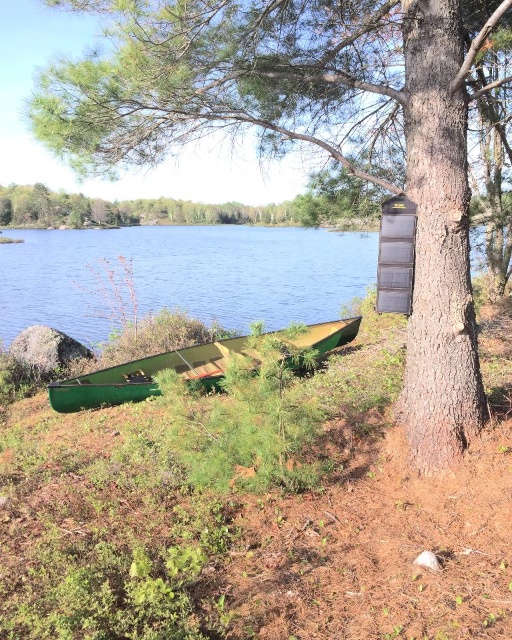
You are a hiker who wants to cross the lake using the green matte canoe at lower left. The smooth bark tree at center has a rope tied around it. Can you reach the tree from the canoe without getting out of the water?

The smooth bark tree at center is 3.10 meters away from the green matte canoe at lower left. Since the canoe is on the shore, you would need to paddle 3.10 meters to reach the tree. However, the tree is on the shore, so you can reach it by paddling from the canoe to the tree as long as the distance is manageable in the water.

You are standing at the edge of the lake and want to walk to the point marked as point (44, 320). There is an obstacle at point (421, 179). Will you encounter the obstacle before reaching your destination?

Yes, you will encounter the obstacle at point (421, 179) before reaching point (44, 320) because point (421, 179) is closer to the viewer than point (44, 320).

You are standing at the center of the image and want to reach the green wood water at lower left. Based on the coordinates provided, in which direction should you move to get there?

The green wood water at lower left is located at coordinates point (181, 275), so you should move towards the lower left direction to reach it.